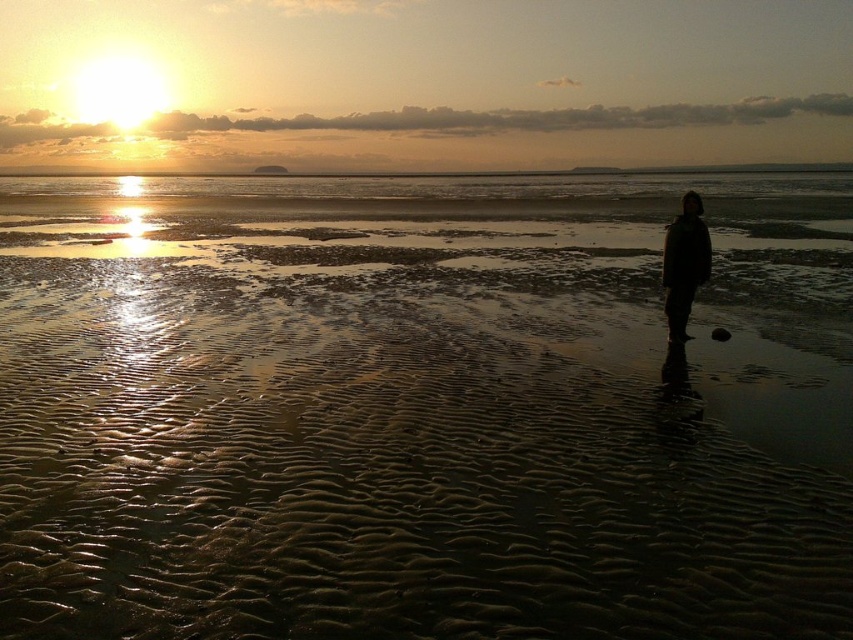
From the picture: You are standing at the point marked as point (x=421, y=410). What surface are you currently standing on?

You are standing on the wet sand at center.

You are standing on the beach and see the wet sand at center and the black matte coat at center. Which object is closer to you?

The wet sand at center is closer to you because it is in front of the black matte coat at center.

You are standing on the beach facing the sunset. There are two points marked on the sand. The first is at coordinates point (215, 467) and the second at point (671, 230). Which point is closer to you?

Point (215, 467) is in front of point (671, 230), so it is closer to you.